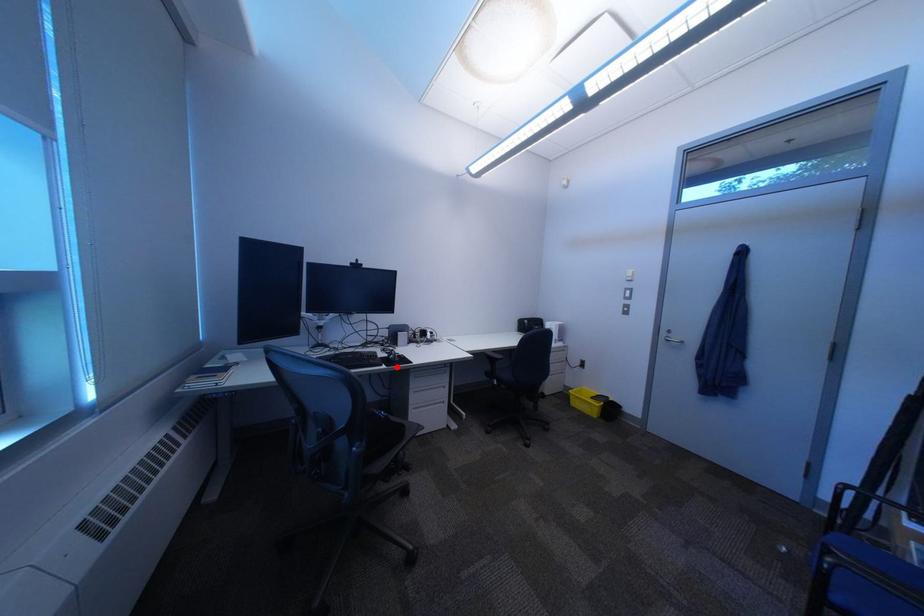
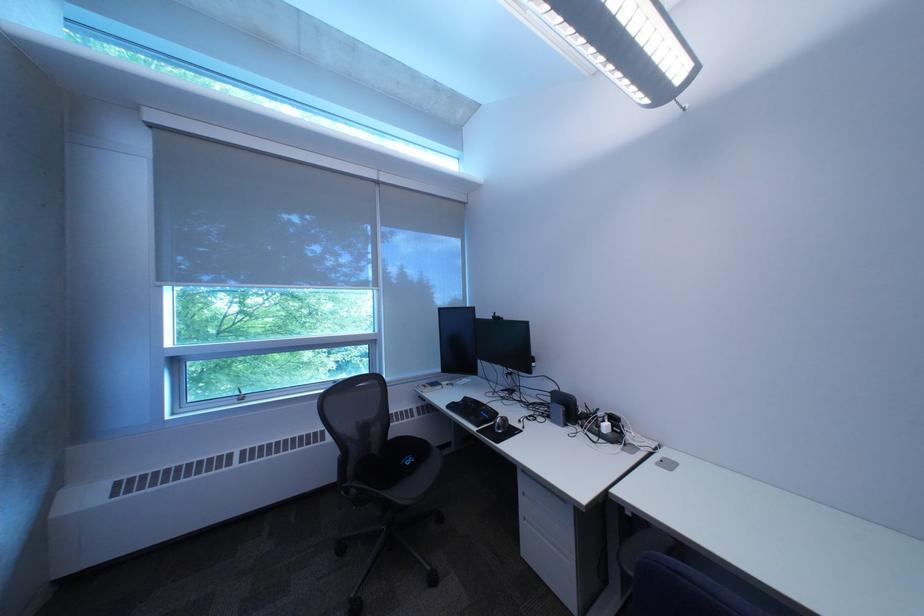
Locate, in the second image, the point that corresponds to the highlighted location in the first image.

(492, 429)